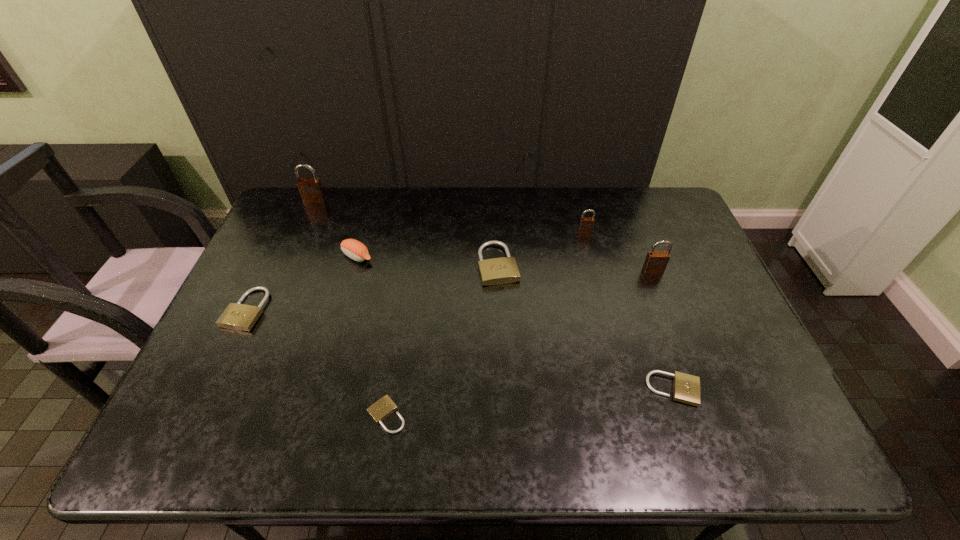
Find the location of a particular element. The image size is (960, 540). free space located 0.320m on the front of the fourth shortest padlock is located at coordinates (503, 385).

Locate an element on the screen. free space located on the front of the third nearest object is located at coordinates (197, 414).

Where is `free point located on the right of the third biggest beige padlock`? Image resolution: width=960 pixels, height=540 pixels. free point located on the right of the third biggest beige padlock is located at coordinates (738, 389).

Locate an element on the screen. Image resolution: width=960 pixels, height=540 pixels. vacant area located 0.050m on the left of the shortest padlock is located at coordinates coord(345,415).

This screenshot has height=540, width=960. Identify the location of object that is at the near edge. (381, 409).

The height and width of the screenshot is (540, 960). Find the location of `object situated at the right edge`. object situated at the right edge is located at coordinates (656, 262).

Locate an element on the screen. object located at the far left corner is located at coordinates (311, 190).

You are a GUI agent. You are given a task and a screenshot of the screen. Output one action in this format:
    pyautogui.click(x=<x>, y=<y>)
    Task: Click on the vacant space at the far edge of the desktop
    
    Given the screenshot: What is the action you would take?
    pyautogui.click(x=585, y=217)

This screenshot has width=960, height=540. What are the coordinates of `vacant space at the near edge of the desktop` in the screenshot? It's located at (591, 432).

Identify the location of free space at the left edge. click(253, 386).